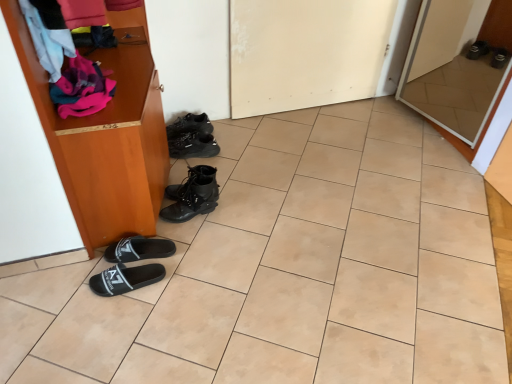
This screenshot has width=512, height=384. Find the location of `free area in between black fabric slipper at lower left, which is the 5th footwear in top-to-bottom order, and white glossy door at upper right, the 1th door in the right-to-left sequence`. free area in between black fabric slipper at lower left, which is the 5th footwear in top-to-bottom order, and white glossy door at upper right, the 1th door in the right-to-left sequence is located at coordinates (314, 186).